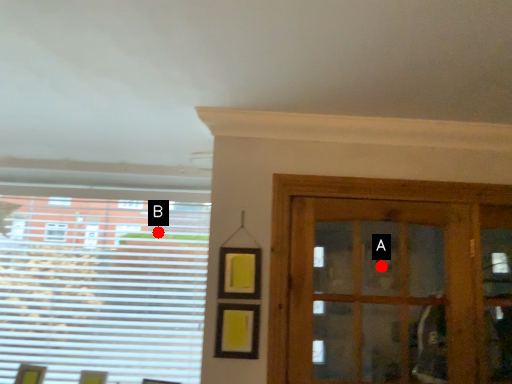
Question: Two points are circled on the image, labeled by A and B beside each circle. Which point appears farthest from the camera in this image?

Choices:
 (A) A is further
 (B) B is further

Answer: (A)